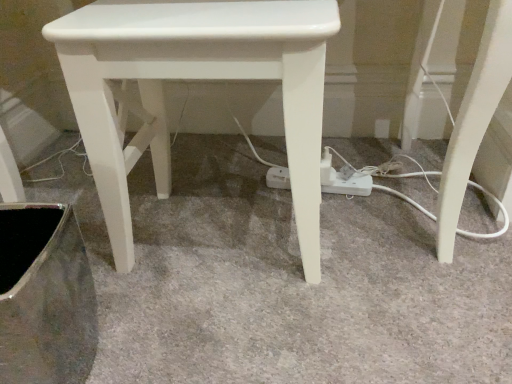
Locate an element on the screen. The image size is (512, 384). white plastic extension cord at center is located at coordinates (345, 183).

In order to click on white glossy stool at center in this screenshot , I will do `click(193, 79)`.

What is the approximate height of metallic silver swivel chair at lower left?

metallic silver swivel chair at lower left is 9.47 inches tall.

The width and height of the screenshot is (512, 384). I want to click on white plastic extension cord at center, so click(345, 183).

Can you see metallic silver swivel chair at lower left touching white plastic extension cord at center?

They are not placed beside each other.

Is metallic silver swivel chair at lower left positioned beyond the bounds of white plastic extension cord at center?

Yes, metallic silver swivel chair at lower left is not within white plastic extension cord at center.

Is point (58, 314) less distant than point (342, 180)?

Yes, it is.

Are white plastic extension cord at center and metallic silver swivel chair at lower left beside each other?

white plastic extension cord at center and metallic silver swivel chair at lower left are not in contact.

Which object is positioned more to the right, white plastic extension cord at center or metallic silver swivel chair at lower left?

white plastic extension cord at center is more to the right.

Which of these two, white plastic extension cord at center or metallic silver swivel chair at lower left, is wider?

metallic silver swivel chair at lower left.

What's the angular difference between white plastic extension cord at center and metallic silver swivel chair at lower left's facing directions?

The facing directions of white plastic extension cord at center and metallic silver swivel chair at lower left are 11.1 degrees apart.

Is white plastic extension cord at center oriented towards white glossy stool at center?

Yes, white plastic extension cord at center faces towards white glossy stool at center.

From the image's perspective, relative to white glossy stool at center, is white plastic extension cord at center above or below?

white plastic extension cord at center is below white glossy stool at center.

Which is in front, point (89, 126) or point (47, 284)?

The point (89, 126) is closer.

Based on the photo, from the image's perspective, would you say white glossy stool at center is shown under metallic silver swivel chair at lower left?

Actually, white glossy stool at center appears above metallic silver swivel chair at lower left in the image.

Is white glossy stool at center further to the viewer compared to metallic silver swivel chair at lower left?

Yes, white glossy stool at center is behind metallic silver swivel chair at lower left.

Considering the sizes of objects white glossy stool at center and metallic silver swivel chair at lower left in the image provided, who is wider, white glossy stool at center or metallic silver swivel chair at lower left?

white glossy stool at center.

Between point (42, 375) and point (309, 155), which one is positioned in front?

The point (42, 375) is more forward.

Between metallic silver swivel chair at lower left and white glossy stool at center, which one has smaller size?

metallic silver swivel chair at lower left is smaller.

I want to click on stool that is on the left side of white plastic extension cord at center, so click(x=193, y=79).

Is white glossy stool at center to the right of white plastic extension cord at center from the viewer's perspective?

Incorrect, white glossy stool at center is not on the right side of white plastic extension cord at center.

Is the position of white glossy stool at center less distant than that of white plastic extension cord at center?

Yes, white glossy stool at center is in front of white plastic extension cord at center.

From a real-world perspective, is white glossy stool at center physically above white plastic extension cord at center?

Yes, from a real-world perspective, white glossy stool at center is above white plastic extension cord at center.

Where is `swivel chair on the left of the white plastic extension cord at center`? This screenshot has width=512, height=384. swivel chair on the left of the white plastic extension cord at center is located at coordinates (45, 296).

Find the location of a particular element. extension cord behind the metallic silver swivel chair at lower left is located at coordinates (345, 183).

When comparing their distances from white plastic extension cord at center, does white glossy stool at center or metallic silver swivel chair at lower left seem further?

metallic silver swivel chair at lower left is positioned further to the anchor white plastic extension cord at center.

Which object lies nearer to the anchor point metallic silver swivel chair at lower left, white glossy stool at center or white plastic extension cord at center?

white glossy stool at center is positioned closer to the anchor metallic silver swivel chair at lower left.

Estimate the real-world distances between objects in this image. Which object is further from white glossy stool at center, metallic silver swivel chair at lower left or white plastic extension cord at center?

white plastic extension cord at center lies further to white glossy stool at center than the other object.

Looking at the image, which one is located further to metallic silver swivel chair at lower left, white plastic extension cord at center or white glossy stool at center?

white plastic extension cord at center lies further to metallic silver swivel chair at lower left than the other object.

Looking at the image, which one is located closer to white glossy stool at center, white plastic extension cord at center or metallic silver swivel chair at lower left?

metallic silver swivel chair at lower left lies closer to white glossy stool at center than the other object.

Based on their spatial positions, is metallic silver swivel chair at lower left or white glossy stool at center closer to white plastic extension cord at center?

white glossy stool at center is positioned closer to the anchor white plastic extension cord at center.

At what (x,y) coordinates should I click in order to perform the action: click on stool located between metallic silver swivel chair at lower left and white plastic extension cord at center in the depth direction. Please return your answer as a coordinate pair (x, y). The height and width of the screenshot is (384, 512). Looking at the image, I should click on (193, 79).